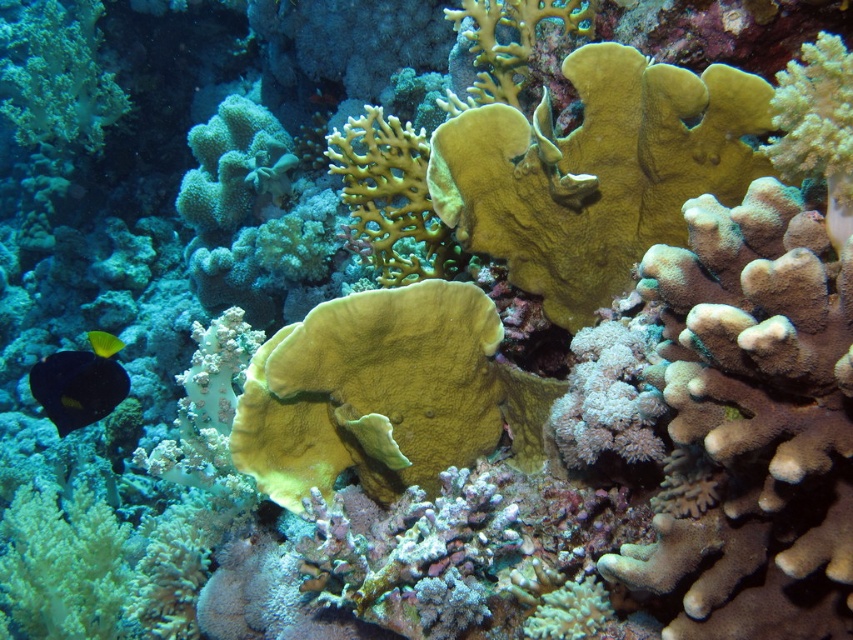
Between shiny black fish at lower left and shiny yellow fish at lower left, which one is positioned higher?

shiny yellow fish at lower left is higher up.

Does point (123, 397) lie behind point (106, 356)?

That is True.

Find the location of `shiny black fish at lower left`. shiny black fish at lower left is located at coordinates (80, 381).